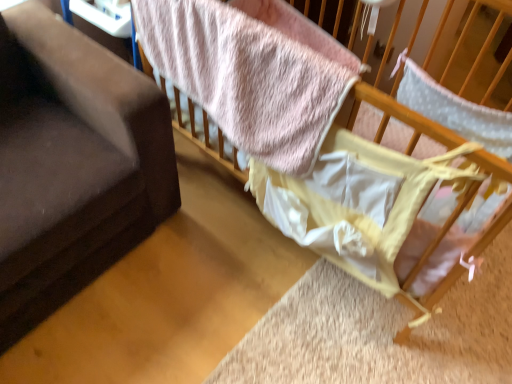
This screenshot has height=384, width=512. What do you see at coordinates (397, 115) in the screenshot? I see `soft pink fabric at upper right` at bounding box center [397, 115].

From the picture: Measure the distance between pink fuzzy blanket at upper center and camera.

pink fuzzy blanket at upper center is 37.11 inches from camera.

Where is `soft pink fabric at upper right`? Image resolution: width=512 pixels, height=384 pixels. soft pink fabric at upper right is located at coordinates (397, 115).

Which of these two, soft pink fabric at upper right or pink fuzzy blanket at upper center, stands shorter?

Standing shorter between the two is pink fuzzy blanket at upper center.

From a real-world perspective, relative to pink fuzzy blanket at upper center, is soft pink fabric at upper right vertically above or below?

In terms of real-world spatial position, soft pink fabric at upper right is below pink fuzzy blanket at upper center.

Can you tell me how much soft pink fabric at upper right and pink fuzzy blanket at upper center differ in facing direction?

The facing directions of soft pink fabric at upper right and pink fuzzy blanket at upper center are 91.1 degrees apart.

In the scene shown: From the image's perspective, would you say soft pink fabric at upper right is shown under pink fuzzy blanket at upper center?

Yes, from the image's perspective, soft pink fabric at upper right is beneath pink fuzzy blanket at upper center.

Find the location of a particular element. This screenshot has height=384, width=512. bed that appears above the soft pink fabric at upper right (from the image's perspective) is located at coordinates (252, 72).

Can you see pink fuzzy blanket at upper center touching soft pink fabric at upper right?

No, pink fuzzy blanket at upper center is not with soft pink fabric at upper right.

Which of these two, pink fuzzy blanket at upper center or soft pink fabric at upper right, is thinner?

With smaller width is pink fuzzy blanket at upper center.

Considering the positions of objects pink fuzzy blanket at upper center and soft pink fabric at upper right in the image provided, who is more to the left, pink fuzzy blanket at upper center or soft pink fabric at upper right?

From the viewer's perspective, pink fuzzy blanket at upper center appears more on the left side.

Does soft pink fabric at upper right appear on the right side of dark gray fabric couch at left?

Yes.

Between soft pink fabric at upper right and dark gray fabric couch at left, which one is positioned behind?

soft pink fabric at upper right is more distant.

The width and height of the screenshot is (512, 384). In order to click on infant bed lying on the right of dark gray fabric couch at left in this screenshot , I will do `click(397, 115)`.

Is soft pink fabric at upper right oriented away from dark gray fabric couch at left?

No.

Which object is further away from the camera taking this photo, dark gray fabric couch at left or soft pink fabric at upper right?

soft pink fabric at upper right is more distant.

Which point is more distant from viewer, [70,174] or [501,176]?

The point [70,174] is behind.

Where is `infant bed above the dark gray fabric couch at left (from a real-world perspective)`? The width and height of the screenshot is (512, 384). infant bed above the dark gray fabric couch at left (from a real-world perspective) is located at coordinates (397, 115).

Is dark gray fabric couch at left facing away from pink fuzzy blanket at upper center?

No, dark gray fabric couch at left is not facing away from pink fuzzy blanket at upper center.

Considering the sizes of objects dark gray fabric couch at left and pink fuzzy blanket at upper center in the image provided, who is bigger, dark gray fabric couch at left or pink fuzzy blanket at upper center?

Bigger between the two is dark gray fabric couch at left.

Is dark gray fabric couch at left taller than pink fuzzy blanket at upper center?

Yes, dark gray fabric couch at left is taller than pink fuzzy blanket at upper center.

From a real-world perspective, which is physically below, dark gray fabric couch at left or pink fuzzy blanket at upper center?

dark gray fabric couch at left.

Consider the image. Can you confirm if pink fuzzy blanket at upper center is smaller than dark gray fabric couch at left?

Correct, pink fuzzy blanket at upper center occupies less space than dark gray fabric couch at left.

Considering the sizes of pink fuzzy blanket at upper center and dark gray fabric couch at left in the image, is pink fuzzy blanket at upper center wider or thinner than dark gray fabric couch at left?

Considering their sizes, pink fuzzy blanket at upper center looks slimmer than dark gray fabric couch at left.

Find the location of a particular element. The height and width of the screenshot is (384, 512). bed above the dark gray fabric couch at left (from a real-world perspective) is located at coordinates (252, 72).

The height and width of the screenshot is (384, 512). Find the location of `bed above the soft pink fabric at upper right (from the image's perspective)`. bed above the soft pink fabric at upper right (from the image's perspective) is located at coordinates (252, 72).

Where is `infant bed below the pink fuzzy blanket at upper center (from the image's perspective)`? The width and height of the screenshot is (512, 384). infant bed below the pink fuzzy blanket at upper center (from the image's perspective) is located at coordinates (397, 115).

Estimate the real-world distances between objects in this image. Which object is closer to dark gray fabric couch at left, soft pink fabric at upper right or pink fuzzy blanket at upper center?

pink fuzzy blanket at upper center lies closer to dark gray fabric couch at left than the other object.

Looking at the image, which one is located closer to dark gray fabric couch at left, pink fuzzy blanket at upper center or soft pink fabric at upper right?

pink fuzzy blanket at upper center lies closer to dark gray fabric couch at left than the other object.

Which object lies further to the anchor point soft pink fabric at upper right, dark gray fabric couch at left or pink fuzzy blanket at upper center?

The object further to soft pink fabric at upper right is dark gray fabric couch at left.

Which object lies nearer to the anchor point pink fuzzy blanket at upper center, dark gray fabric couch at left or soft pink fabric at upper right?

dark gray fabric couch at left is closer to pink fuzzy blanket at upper center.

Which object lies further to the anchor point pink fuzzy blanket at upper center, soft pink fabric at upper right or dark gray fabric couch at left?

soft pink fabric at upper right is further to pink fuzzy blanket at upper center.

Looking at the image, which one is located closer to soft pink fabric at upper right, pink fuzzy blanket at upper center or dark gray fabric couch at left?

pink fuzzy blanket at upper center.

This screenshot has height=384, width=512. Identify the location of bed between dark gray fabric couch at left and soft pink fabric at upper right from left to right. (252, 72).